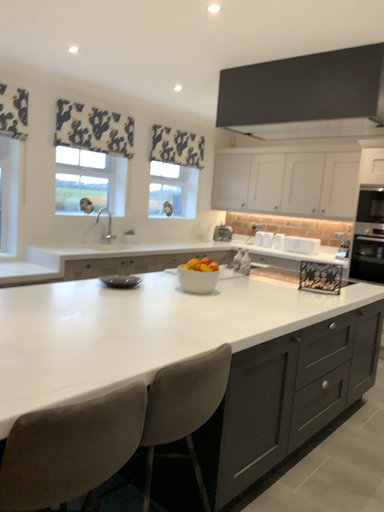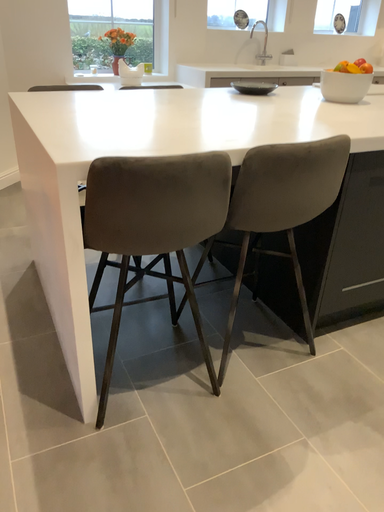
Question: Which way did the camera rotate in the video?

Choices:
 (A) rotated right
 (B) rotated left

Answer: (B)